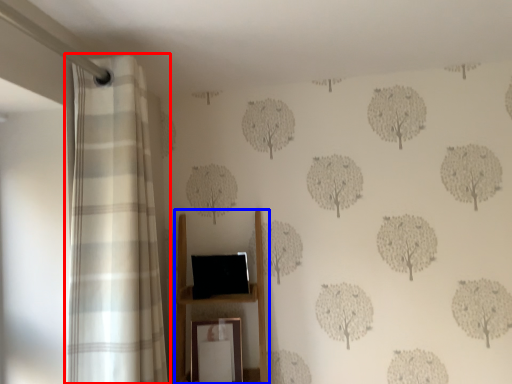
Question: Which of the following is the farthest to the observer, curtain (highlighted by a red box) or furniture (highlighted by a blue box)?

Choices:
 (A) curtain
 (B) furniture

Answer: (B)